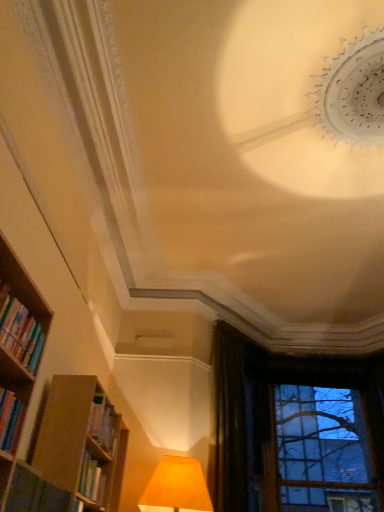
Question: From a real-world perspective, relative to dark velvet curtain at upper right, is transparent glass window at lower right vertically above or below?

Choices:
 (A) above
 (B) below

Answer: (A)

Question: Is transparent glass window at lower right wider or thinner than dark velvet curtain at upper right?

Choices:
 (A) wide
 (B) thin

Answer: (A)

Question: Which of these objects is positioned farthest from the dark velvet curtain at upper right?

Choices:
 (A) transparent glass window at lower right
 (B) hardcover book at lower left, the second book when ordered from top to bottom
 (C) hardcover books at left, the second book ordered from the bottom

Answer: (C)

Question: Which object is positioned closest to the dark velvet curtain at upper right?

Choices:
 (A) hardcover book at lower left, which ranks as the 1th book in bottom-to-top order
 (B) transparent glass window at lower right
 (C) hardcover books at left, the first book from the top

Answer: (B)